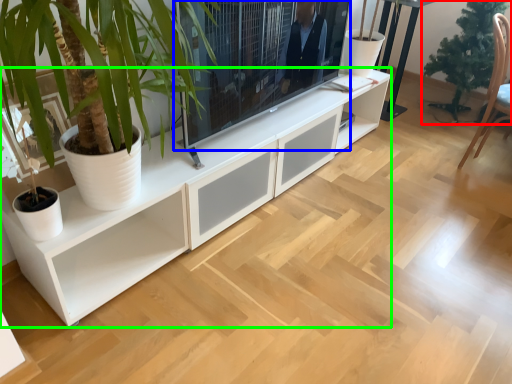
Question: Which is nearer to the houseplant (highlighted by a red box)? television (highlighted by a blue box) or cabinetry (highlighted by a green box).

Choices:
 (A) television
 (B) cabinetry

Answer: (B)